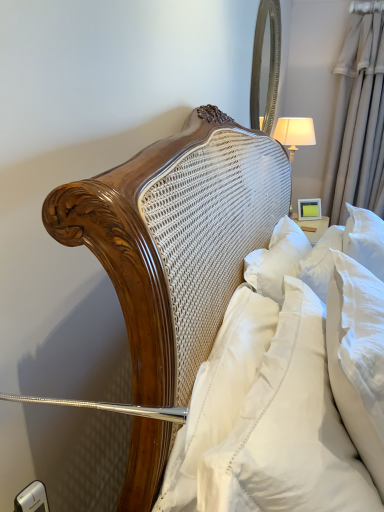
The height and width of the screenshot is (512, 384). Describe the element at coordinates (263, 62) in the screenshot. I see `silver/metallic mirror at upper right` at that location.

The height and width of the screenshot is (512, 384). Describe the element at coordinates (219, 392) in the screenshot. I see `white satin pillow at center, which ranks as the third pillow in front-to-back order` at that location.

Where is `silver/metallic mirror at upper right`? silver/metallic mirror at upper right is located at coordinates (263, 62).

Is point (204, 442) positioned in front of point (311, 139)?

Yes, point (204, 442) is in front of point (311, 139).

Do you think white satin pillow at center, which ranks as the third pillow in front-to-back order, is within white fabric lampshade at upper right, or outside of it?

white satin pillow at center, which ranks as the third pillow in front-to-back order, cannot be found inside white fabric lampshade at upper right.

Is white satin pillow at center, the first pillow in the back-to-front sequence, thinner than white fabric lampshade at upper right?

Indeed, white satin pillow at center, the first pillow in the back-to-front sequence, has a lesser width compared to white fabric lampshade at upper right.

Considering the sizes of objects silver/metallic mirror at upper right and white soft pillow at upper right, the first pillow from the front, in the image provided, who is bigger, silver/metallic mirror at upper right or white soft pillow at upper right, the first pillow from the front,?

With larger size is white soft pillow at upper right, the first pillow from the front.

Considering their positions, is silver/metallic mirror at upper right located in front of or behind white soft pillow at upper right, the first pillow from the front?

In the image, silver/metallic mirror at upper right appears behind white soft pillow at upper right, the first pillow from the front.

Could you tell me if silver/metallic mirror at upper right is turned towards white soft pillow at upper right, the first pillow from the front?

No.

How many degrees apart are the facing directions of silver/metallic mirror at upper right and white soft pillow at upper right, which is counted as the third pillow, starting from the back?

They differ by 1.16 degrees in their facing directions.

This screenshot has width=384, height=512. Find the location of `bedside lamp that is under the silver/metallic mirror at upper right (from a real-world perspective)`. bedside lamp that is under the silver/metallic mirror at upper right (from a real-world perspective) is located at coordinates (294, 137).

Is silver/metallic mirror at upper right a part of white fabric lampshade at upper right?

That's incorrect, silver/metallic mirror at upper right is not inside white fabric lampshade at upper right.

Based on their positions, is white fabric lampshade at upper right located to the left or right of silver/metallic mirror at upper right?

From the image, it's evident that white fabric lampshade at upper right is to the right of silver/metallic mirror at upper right.

Based on the photo, would you consider white fabric lampshade at upper right to be distant from silver/metallic mirror at upper right?

white fabric lampshade at upper right is actually quite close to silver/metallic mirror at upper right.

Would you say white soft pillow at upper right, the first pillow from the front, is to the left or to the right of silver/metallic mirror at upper right in the picture?

Clearly, white soft pillow at upper right, the first pillow from the front, is on the left of silver/metallic mirror at upper right in the image.

Is silver/metallic mirror at upper right surrounded by white soft pillow at upper right, which is counted as the third pillow, starting from the back?

No, silver/metallic mirror at upper right is not surrounded by white soft pillow at upper right, which is counted as the third pillow, starting from the back.

Can you confirm if white soft pillow at upper right, which is counted as the third pillow, starting from the back, is bigger than silver/metallic mirror at upper right?

Indeed, white soft pillow at upper right, which is counted as the third pillow, starting from the back, has a larger size compared to silver/metallic mirror at upper right.

I want to click on mirror above the white soft pillow at upper right, which is counted as the third pillow, starting from the back (from the image's perspective), so click(263, 62).

Considering the relative positions of white soft pillow at right, the 2th pillow viewed from the back, and silky beige curtain at right in the image provided, is white soft pillow at right, the 2th pillow viewed from the back, to the left of silky beige curtain at right from the viewer's perspective?

Correct, you'll find white soft pillow at right, the 2th pillow viewed from the back, to the left of silky beige curtain at right.

How many degrees apart are the facing directions of white soft pillow at right, the 2th pillow from the front, and silky beige curtain at right?

94.1 degrees separate the facing orientations of white soft pillow at right, the 2th pillow from the front, and silky beige curtain at right.

This screenshot has height=512, width=384. In order to click on the 1st pillow positioned below the silky beige curtain at right (from a real-world perspective) in this screenshot , I will do `click(358, 358)`.

From the image's perspective, which object appears higher, white soft pillow at right, the 2th pillow from the front, or silky beige curtain at right?

silky beige curtain at right.

Considering the relative positions of white soft pillow at right, the 2th pillow viewed from the back, and white fabric lampshade at upper right in the image provided, is white soft pillow at right, the 2th pillow viewed from the back, behind white fabric lampshade at upper right?

No, the depth of white soft pillow at right, the 2th pillow viewed from the back, is less than that of white fabric lampshade at upper right.

Is white soft pillow at right, the 2th pillow viewed from the back, at the right side of white fabric lampshade at upper right?

Incorrect, white soft pillow at right, the 2th pillow viewed from the back, is not on the right side of white fabric lampshade at upper right.

From the image's perspective, relative to white fabric lampshade at upper right, is white soft pillow at right, the 2th pillow viewed from the back, above or below?

Based on their image positions, white soft pillow at right, the 2th pillow viewed from the back, is located beneath white fabric lampshade at upper right.

Can you confirm if white soft pillow at right, the 2th pillow viewed from the back, is smaller than white fabric lampshade at upper right?

Actually, white soft pillow at right, the 2th pillow viewed from the back, might be larger than white fabric lampshade at upper right.

From the image's perspective, would you say white soft pillow at right, the 2th pillow viewed from the back, is positioned over white soft pillow at upper right, the first pillow from the front?

Yes, from the image's perspective, white soft pillow at right, the 2th pillow viewed from the back, is over white soft pillow at upper right, the first pillow from the front.

Which is farther, (368, 335) or (281, 430)?

Positioned behind is point (368, 335).

From a real-world perspective, which is physically above, white soft pillow at right, the 2th pillow viewed from the back, or white soft pillow at upper right, which is counted as the third pillow, starting from the back?

In real-world perspective, white soft pillow at right, the 2th pillow viewed from the back, is above.

Locate an element on the screen. This screenshot has width=384, height=512. bedside lamp that is on the right side of white satin pillow at center, which ranks as the third pillow in front-to-back order is located at coordinates click(294, 137).

The height and width of the screenshot is (512, 384). I want to click on the 2nd pillow below the silver/metallic mirror at upper right (from the image's perspective), so point(289,430).

From the image, which object appears to be farther from silver/metallic mirror at upper right, silky beige curtain at right or white soft pillow at upper right, which is counted as the third pillow, starting from the back?

white soft pillow at upper right, which is counted as the third pillow, starting from the back, is further to silver/metallic mirror at upper right.

Which object lies further to the anchor point silver/metallic mirror at upper right, white satin pillow at center, the first pillow in the back-to-front sequence, or white fabric lampshade at upper right?

The object further to silver/metallic mirror at upper right is white satin pillow at center, the first pillow in the back-to-front sequence.

Considering their positions, is silky beige curtain at right positioned further to white soft pillow at upper right, the first pillow from the front, than white soft pillow at right, the 2th pillow viewed from the back?

silky beige curtain at right lies further to white soft pillow at upper right, the first pillow from the front, than the other object.

In the scene shown: From the image, which object appears to be nearer to silky beige curtain at right, white fabric lampshade at upper right or white soft pillow at upper right, which is counted as the third pillow, starting from the back?

white fabric lampshade at upper right lies closer to silky beige curtain at right than the other object.

Based on their spatial positions, is silver/metallic mirror at upper right or white satin pillow at center, which ranks as the third pillow in front-to-back order, further from white soft pillow at upper right, which is counted as the third pillow, starting from the back?

Based on the image, silver/metallic mirror at upper right appears to be further to white soft pillow at upper right, which is counted as the third pillow, starting from the back.

Considering their positions, is white soft pillow at right, the 2th pillow from the front, positioned closer to white fabric lampshade at upper right than silky beige curtain at right?

Based on the image, silky beige curtain at right appears to be nearer to white fabric lampshade at upper right.

Looking at the image, which one is located further to white soft pillow at upper right, which is counted as the third pillow, starting from the back, silky beige curtain at right or white fabric lampshade at upper right?

silky beige curtain at right is further to white soft pillow at upper right, which is counted as the third pillow, starting from the back.

Consider the image. When comparing their distances from silver/metallic mirror at upper right, does silky beige curtain at right or white fabric lampshade at upper right seem closer?

white fabric lampshade at upper right.

In order to click on curtain between silver/metallic mirror at upper right and white satin pillow at center, which ranks as the third pillow in front-to-back order, from top to bottom in this screenshot , I will do `click(358, 121)`.

I want to click on mirror positioned between white soft pillow at upper right, which is counted as the third pillow, starting from the back, and silky beige curtain at right from near to far, so click(x=263, y=62).

Where is `mirror positioned between white soft pillow at right, the 2th pillow from the front, and silky beige curtain at right from near to far`? mirror positioned between white soft pillow at right, the 2th pillow from the front, and silky beige curtain at right from near to far is located at coordinates (263, 62).

Where is `mirror between white soft pillow at upper right, which is counted as the third pillow, starting from the back, and white fabric lampshade at upper right in the front-back direction`? The height and width of the screenshot is (512, 384). mirror between white soft pillow at upper right, which is counted as the third pillow, starting from the back, and white fabric lampshade at upper right in the front-back direction is located at coordinates (263, 62).